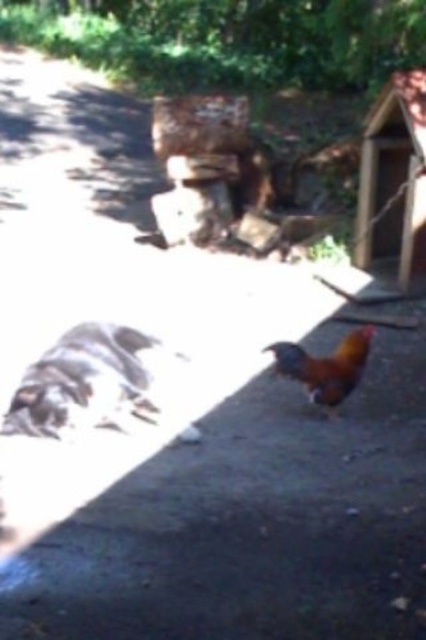
You are a farmer checking the coop and notice the brown feathered chicken at center and the rusty metallic rooster at center. Which one is wider?

The brown feathered chicken at center is wider than the rusty metallic rooster at center.

You are a birdwatcher trying to estimate distances in the scene. The brown feathered chicken at center and the rusty metallic rooster at center are both in your line of sight. How far apart are these two birds in feet?

The brown feathered chicken at center is 32.86 inches from rusty metallic rooster at center, which converts to approximately 2.74 feet. Therefore, the two birds are about 2.74 feet apart.